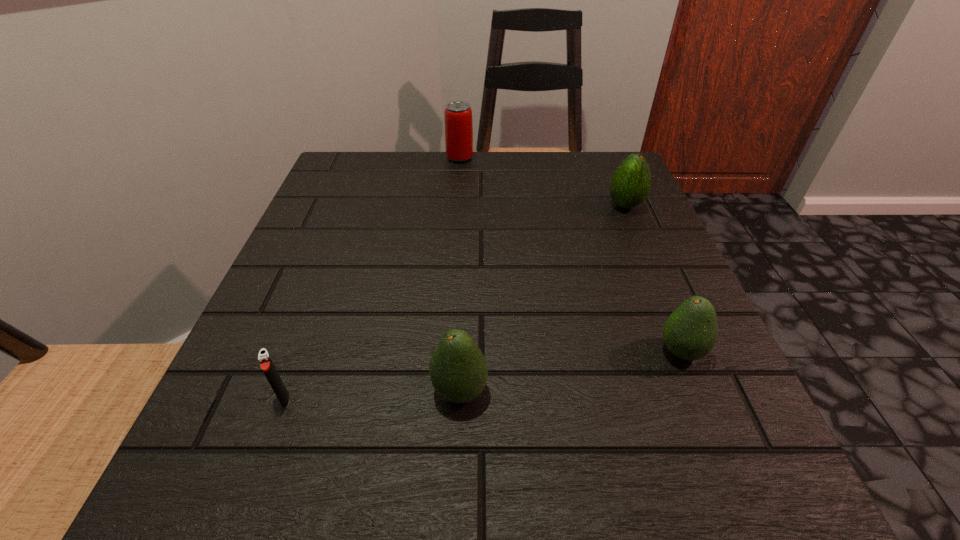
Identify the location of vacant area that lies between the igniter and the beer can. This screenshot has width=960, height=540. (372, 278).

The height and width of the screenshot is (540, 960). In order to click on object that is the closest to the leftmost avocado in this screenshot , I will do `click(266, 364)`.

Locate an element on the screen. The width and height of the screenshot is (960, 540). object that stands as the fourth closest to the fourth nearest object is located at coordinates (266, 364).

Where is `avocado that is the second nearest to the leftmost avocado`? avocado that is the second nearest to the leftmost avocado is located at coordinates (630, 184).

Select which avocado appears as the closest to the leftmost avocado. Please provide its 2D coordinates. Your answer should be formatted as a tuple, i.e. [(x, y)], where the tuple contains the x and y coordinates of a point satisfying the conditions above.

[(690, 332)]

The height and width of the screenshot is (540, 960). In order to click on free space that satisfies the following two spatial constraints: 1. on the front side of the second farthest object; 2. on the left side of the beer can in this screenshot , I will do `click(456, 205)`.

This screenshot has height=540, width=960. Find the location of `vacant space that satisfies the following two spatial constraints: 1. on the front side of the second farthest object; 2. on the left side of the beer can`. vacant space that satisfies the following two spatial constraints: 1. on the front side of the second farthest object; 2. on the left side of the beer can is located at coordinates (456, 205).